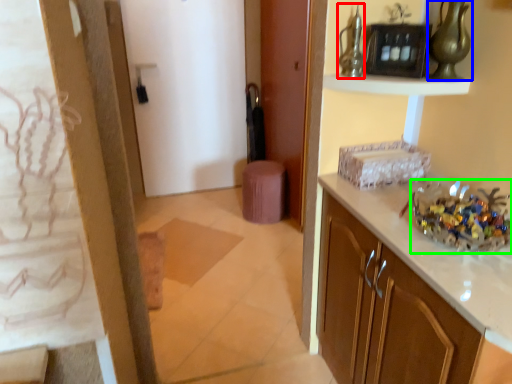
Question: Which object is positioned closest to glass vase (highlighted by a red box)? Select from glass vase (highlighted by a blue box) and floral arrangement (highlighted by a green box).

Choices:
 (A) glass vase
 (B) floral arrangement

Answer: (A)